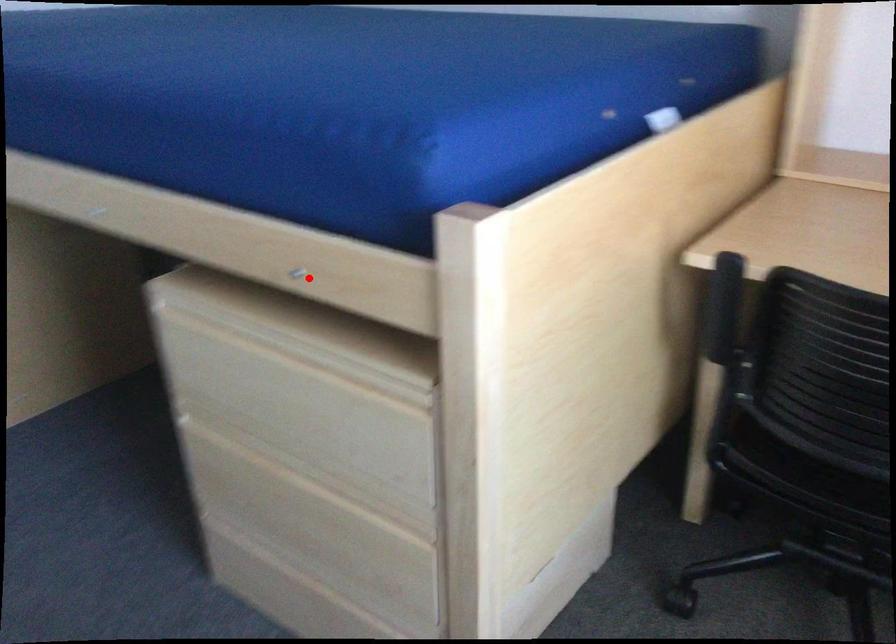
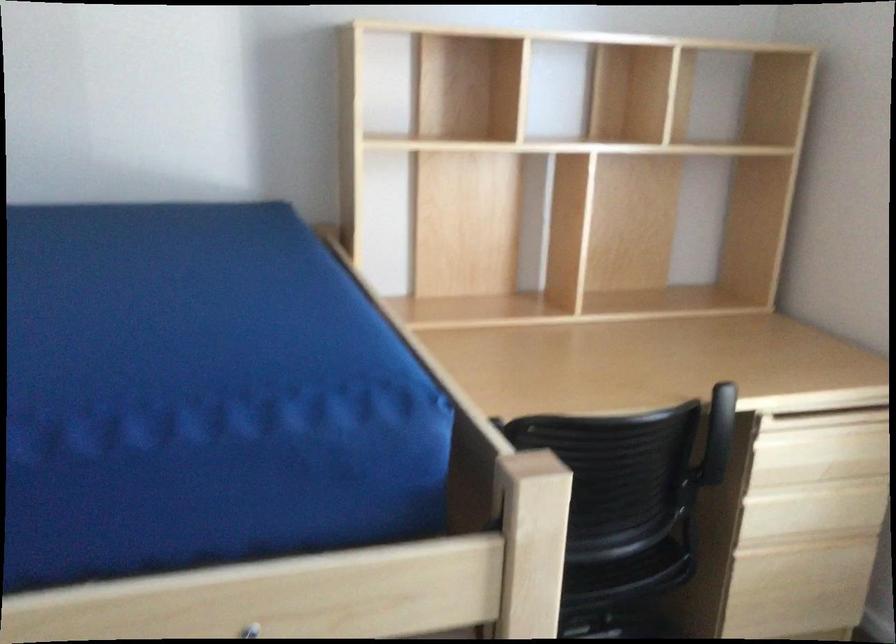
Locate, in the second image, the point that corresponds to the highlighted location in the first image.

(250, 630)